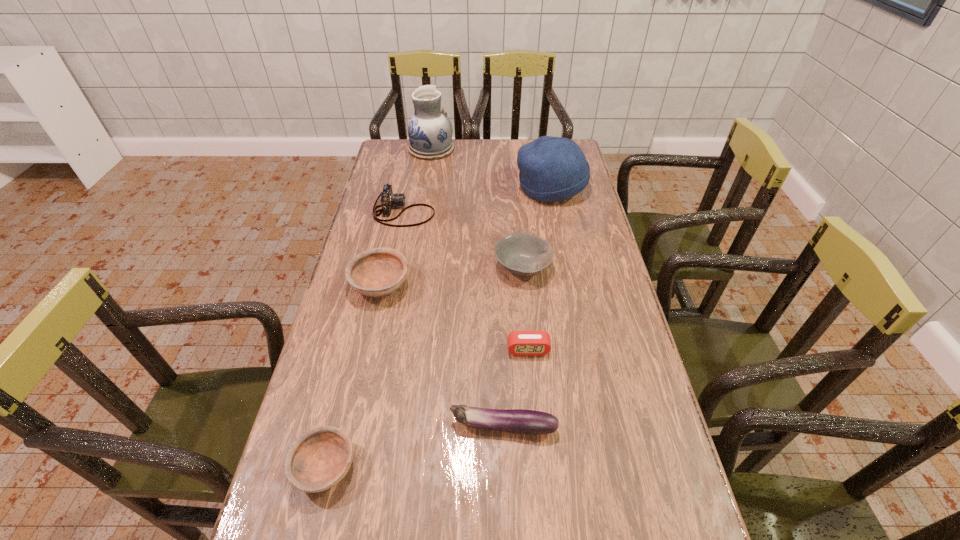
Locate which bowl is the second closest to the purple eggplant. Please provide its 2D coordinates. Your answer should be formatted as a tuple, i.e. [(x, y)], where the tuple contains the x and y coordinates of a point satisfying the conditions above.

[(377, 272)]

You are a GUI agent. You are given a task and a screenshot of the screen. Output one action in this format:
    pyautogui.click(x=<x>, y=<y>)
    Task: Click on the free space that satisfies the following two spatial constraints: 1. on the front side of the bigger brown bowl; 2. on the right side of the eggplant
    Image resolution: width=960 pixels, height=540 pixels.
    Given the screenshot: What is the action you would take?
    pyautogui.click(x=348, y=427)

At what (x,y) coordinates should I click in order to perform the action: click on vacant space that satisfies the following two spatial constraints: 1. on the back side of the second tallest object; 2. on the right side of the farther brown bowl. Please return your answer as a coordinate pair (x, y). Looking at the image, I should click on (401, 187).

Identify the location of vacant space that satisfies the following two spatial constraints: 1. on the front-facing side of the eggplant; 2. on the right side of the camera. This screenshot has width=960, height=540. (x=360, y=427).

I want to click on vacant space that satisfies the following two spatial constraints: 1. on the front-facing side of the camera; 2. on the left side of the purple eggplant, so click(360, 427).